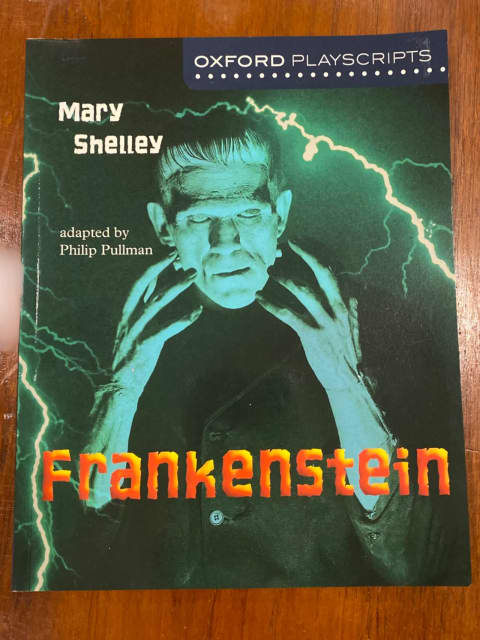
You are a GUI agent. You are given a task and a screenshot of the screen. Output one action in this format:
    pyautogui.click(x=<x>, y=<y>)
    Task: Click on the poster
    Image resolution: width=480 pixels, height=640 pixels.
    Given the screenshot: What is the action you would take?
    pyautogui.click(x=313, y=564)